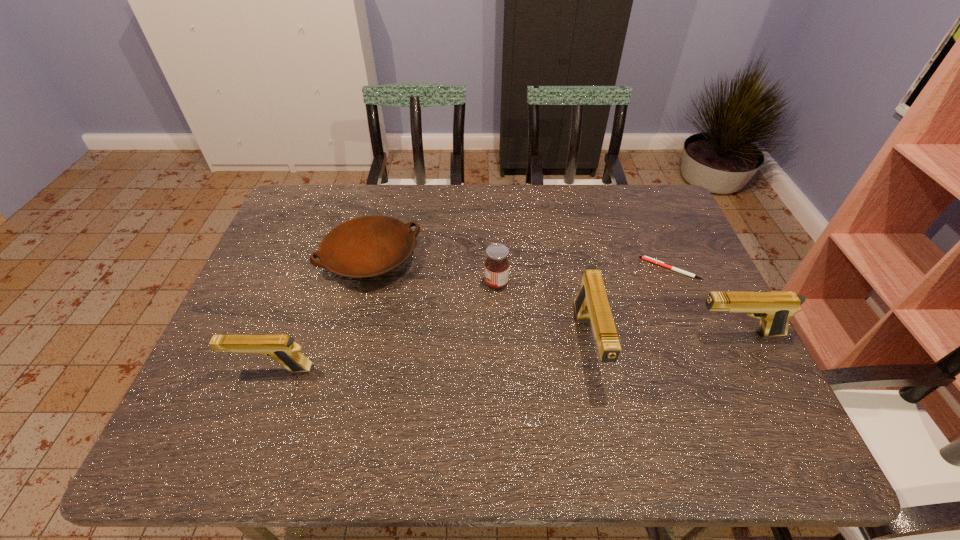
This screenshot has width=960, height=540. Identify the location of the shortest pistol. (282, 348).

Locate an element on the screen. the fourth object from left to right is located at coordinates (x=591, y=304).

Where is `the second tallest pistol`? The image size is (960, 540). the second tallest pistol is located at coordinates (774, 309).

Find the location of a particular element. This screenshot has width=960, height=540. the second tallest object is located at coordinates (774, 309).

The image size is (960, 540). Identify the location of plate. (369, 246).

Where is `the fourth object from right to left`? the fourth object from right to left is located at coordinates (496, 270).

Image resolution: width=960 pixels, height=540 pixels. Find the location of `the shortest object`. the shortest object is located at coordinates coord(646,258).

Find the location of a particular element. This screenshot has width=960, height=540. free space located 0.310m at the barrel of the fifth shortest object is located at coordinates (564, 334).

At what (x,y) coordinates should I click in order to perform the action: click on vacant space located at the barrel of the fifth shortest object. Please return your answer as a coordinate pair (x, y). Image resolution: width=960 pixels, height=540 pixels. Looking at the image, I should click on (577, 334).

Where is `vacant space located at the barrel of the fifth shortest object`? vacant space located at the barrel of the fifth shortest object is located at coordinates (588, 334).